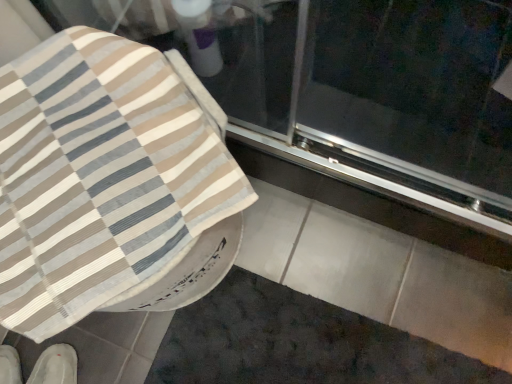
In order to click on vacant space situated above dark gray textured bath mat at lower center (from a real-world perspective) in this screenshot , I will do `click(306, 346)`.